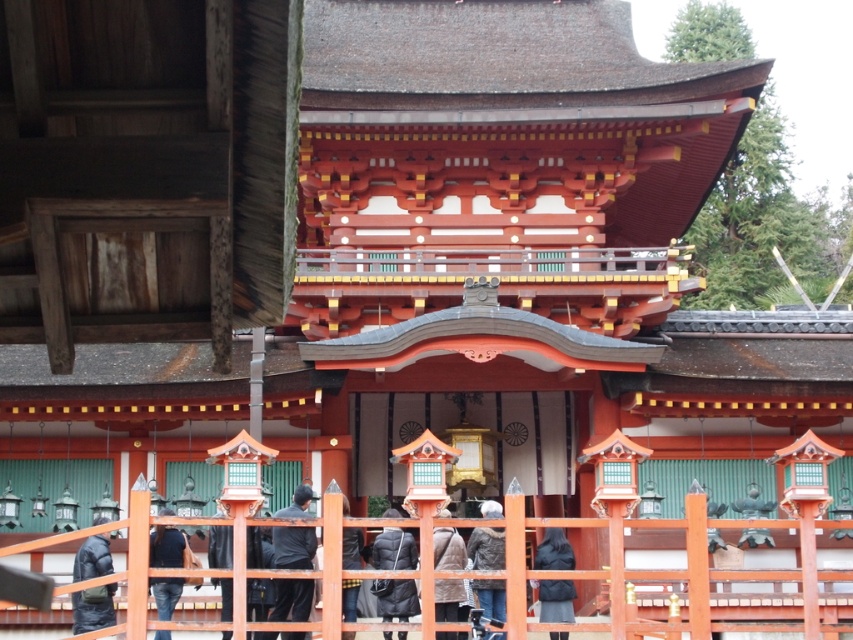
Question: Does dark gray fabric pants at center have a greater width compared to dark gray fabric jacket at lower center?

Choices:
 (A) no
 (B) yes

Answer: (A)

Question: Observing the image, what is the correct spatial positioning of black puffy jacket at lower left in reference to dark gray fabric jacket at lower center?

Choices:
 (A) above
 (B) below

Answer: (B)

Question: Which point appears closest to the camera in this image?

Choices:
 (A) (109, 595)
 (B) (166, 544)
 (C) (440, 531)

Answer: (A)

Question: Estimate the real-world distances between objects in this image. Which object is closer to the wooden fence at center?

Choices:
 (A) dark gray fabric pants at center
 (B) gray woolen jacket at center
 (C) dark blue denim jeans at lower left

Answer: (A)

Question: Is dark gray fabric pants at center above black puffer jacket at center?

Choices:
 (A) yes
 (B) no

Answer: (A)

Question: Which object appears closest to the camera in this image?

Choices:
 (A) dark gray fabric pants at center
 (B) black puffer jacket at center
 (C) gray woolen jacket at center
 (D) black puffy jacket at lower left

Answer: (B)